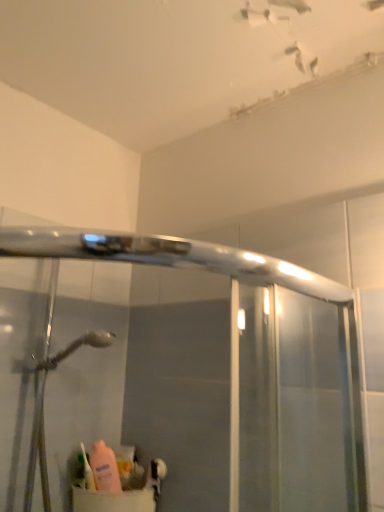
Question: From a real-world perspective, is translucent plastic toothbrush at lower left physically located above or below pink matte sink at lower left?

Choices:
 (A) above
 (B) below

Answer: (A)

Question: Considering the positions of point (84, 458) and point (130, 489), is point (84, 458) closer or farther from the camera than point (130, 489)?

Choices:
 (A) farther
 (B) closer

Answer: (A)

Question: From the image's perspective, is translucent plastic toothbrush at lower left located above or below pink matte sink at lower left?

Choices:
 (A) above
 (B) below

Answer: (A)

Question: Is pink matte sink at lower left wider or thinner than translucent plastic toothbrush at lower left?

Choices:
 (A) thin
 (B) wide

Answer: (B)

Question: Would you say pink matte sink at lower left is inside or outside translucent plastic toothbrush at lower left?

Choices:
 (A) outside
 (B) inside

Answer: (A)

Question: Based on their positions, is pink matte sink at lower left located to the left or right of translucent plastic toothbrush at lower left?

Choices:
 (A) left
 (B) right

Answer: (B)

Question: Relative to translucent plastic toothbrush at lower left, is pink matte sink at lower left in front or behind?

Choices:
 (A) behind
 (B) front

Answer: (B)